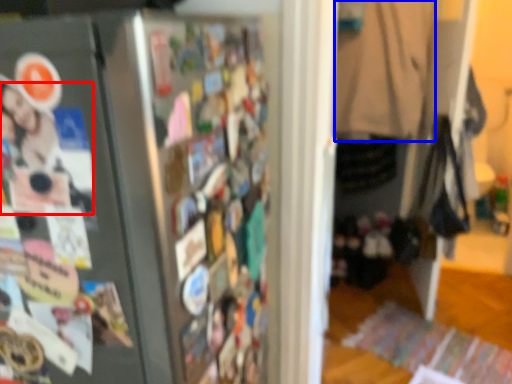
Question: Which point is further to the camera, person (highlighted by a red box) or clothing (highlighted by a blue box)?

Choices:
 (A) person
 (B) clothing

Answer: (B)